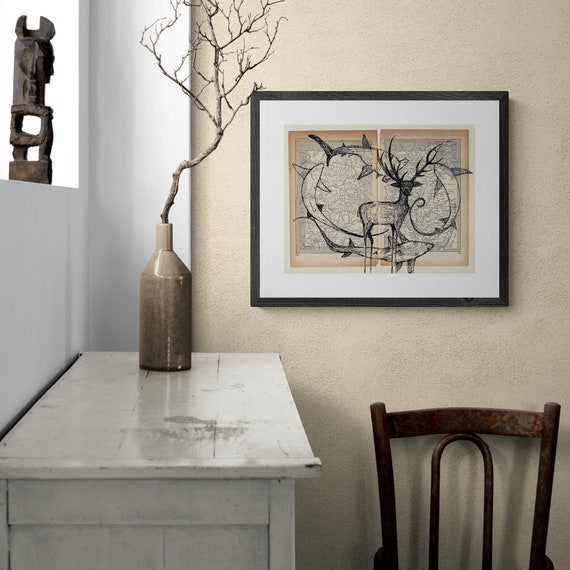
Identify the location of 1 plant. (217, 146).